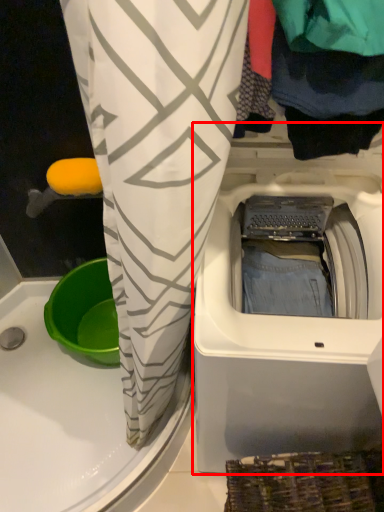
Question: Considering the relative positions of washing machine (annotated by the red box) and clothing in the image provided, where is washing machine (annotated by the red box) located with respect to the staircase?

Choices:
 (A) left
 (B) right

Answer: (A)